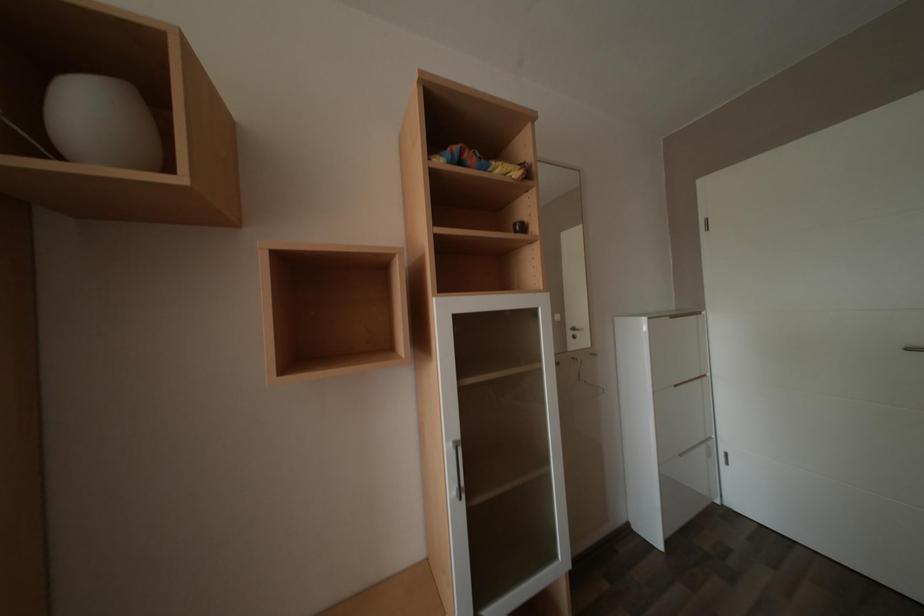
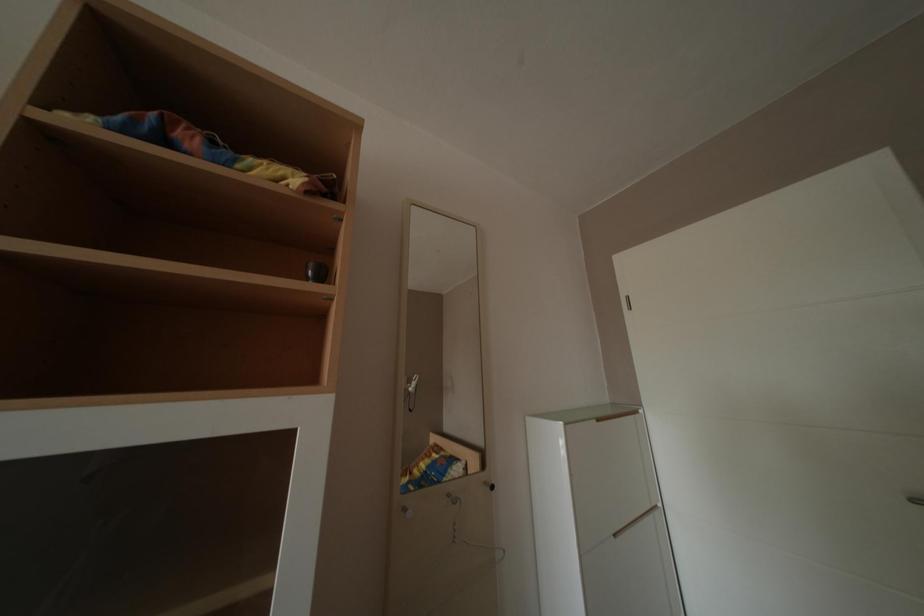
In a continuous first-person perspective shot, in which direction is the camera moving?

The cameraman moved toward right, forward.